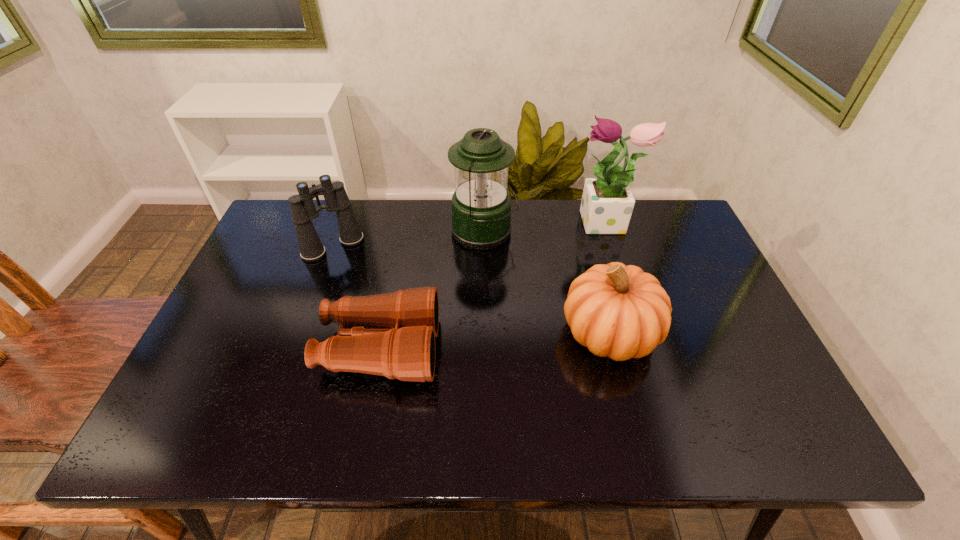
Locate an element on the screen. The width and height of the screenshot is (960, 540). free location located 0.120m on the back of the taller binoculars is located at coordinates (347, 210).

Locate an element on the screen. vacant space located on the back of the pumpkin is located at coordinates (583, 230).

At what (x,y) coordinates should I click in order to perform the action: click on free location located 0.300m through the lenses of the nearer binoculars. Please return your answer as a coordinate pair (x, y). Looking at the image, I should click on (559, 349).

In order to click on flower arrangement positioned at the far edge in this screenshot , I will do `click(607, 203)`.

Locate an element on the screen. lantern located in the far edge section of the desktop is located at coordinates (481, 205).

I want to click on binoculars located in the far edge section of the desktop, so click(303, 210).

The width and height of the screenshot is (960, 540). What are the coordinates of `object at the left edge` in the screenshot? It's located at (303, 210).

You are a GUI agent. You are given a task and a screenshot of the screen. Output one action in this format:
    pyautogui.click(x=<x>, y=<y>)
    Task: Click on the object that is at the far left corner
    
    Given the screenshot: What is the action you would take?
    pyautogui.click(x=303, y=210)

The height and width of the screenshot is (540, 960). I want to click on free space at the far edge of the desktop, so click(539, 233).

Where is `vacant space at the near edge`? Image resolution: width=960 pixels, height=540 pixels. vacant space at the near edge is located at coordinates (468, 435).